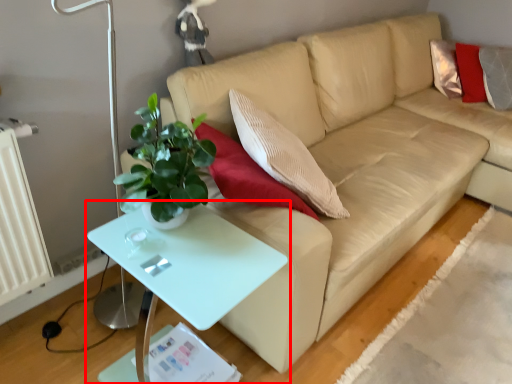
Question: From the image's perspective, where is table (annotated by the red box) located in relation to studio couch in the image?

Choices:
 (A) above
 (B) below

Answer: (B)